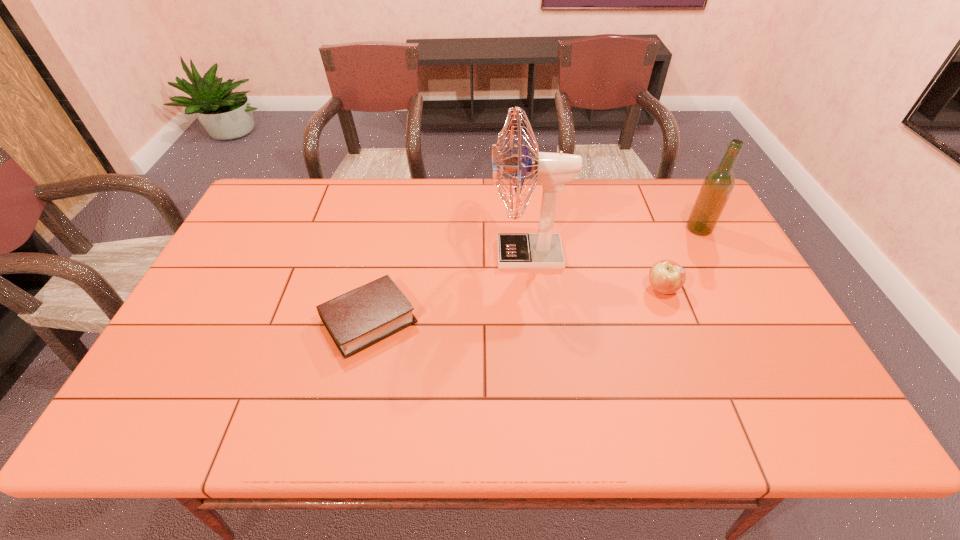
What are the coordinates of `the tallest object` in the screenshot? It's located at (542, 250).

Identify the location of fan. (542, 250).

Locate an element on the screen. The image size is (960, 540). the second tallest object is located at coordinates (718, 185).

Find the location of a particular element. The height and width of the screenshot is (540, 960). the rightmost object is located at coordinates (718, 185).

Locate an element on the screen. This screenshot has width=960, height=540. apple is located at coordinates (666, 277).

At what (x,y) coordinates should I click in order to perform the action: click on the second object from right to left. Please return your answer as a coordinate pair (x, y). Looking at the image, I should click on click(666, 277).

Locate an element on the screen. This screenshot has height=540, width=960. the shortest object is located at coordinates (363, 316).

This screenshot has height=540, width=960. I want to click on the leftmost object, so click(x=363, y=316).

This screenshot has height=540, width=960. I want to click on vacant space positioned on the front-facing side of the third object from right to left, so click(439, 254).

You are a GUI agent. You are given a task and a screenshot of the screen. Output one action in this format:
    pyautogui.click(x=<x>, y=<y>)
    Task: Click on the blank space located 0.250m on the front-facing side of the third object from right to left
    
    Given the screenshot: What is the action you would take?
    pyautogui.click(x=405, y=254)